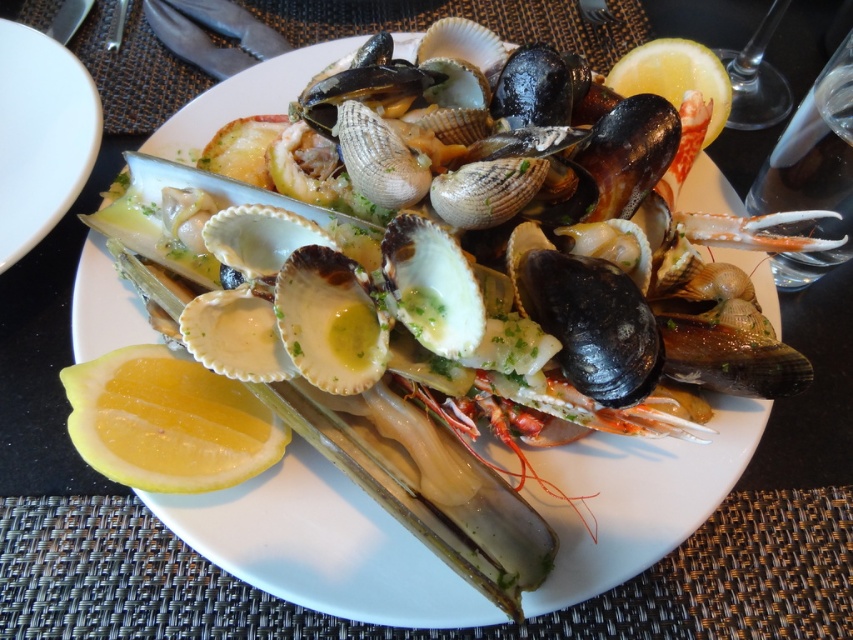
Question: Where is white glossy plate at upper left located in relation to yellow matte lemon at upper right in the image?

Choices:
 (A) below
 (B) above

Answer: (A)

Question: Is white glossy plate at upper left wider than yellow matte lemon at upper right?

Choices:
 (A) yes
 (B) no

Answer: (A)

Question: Which point appears closest to the camera in this image?

Choices:
 (A) (606, 76)
 (B) (134, 460)
 (C) (15, 189)

Answer: (B)

Question: Which point is closer to the camera taking this photo?

Choices:
 (A) (61, 140)
 (B) (700, 60)

Answer: (A)

Question: Among these objects, which one is nearest to the camera?

Choices:
 (A) yellow juicy lemon at lower left
 (B) white glossy plate at upper left

Answer: (A)

Question: Is white glossy plate at upper left smaller than yellow matte lemon at upper right?

Choices:
 (A) no
 (B) yes

Answer: (A)